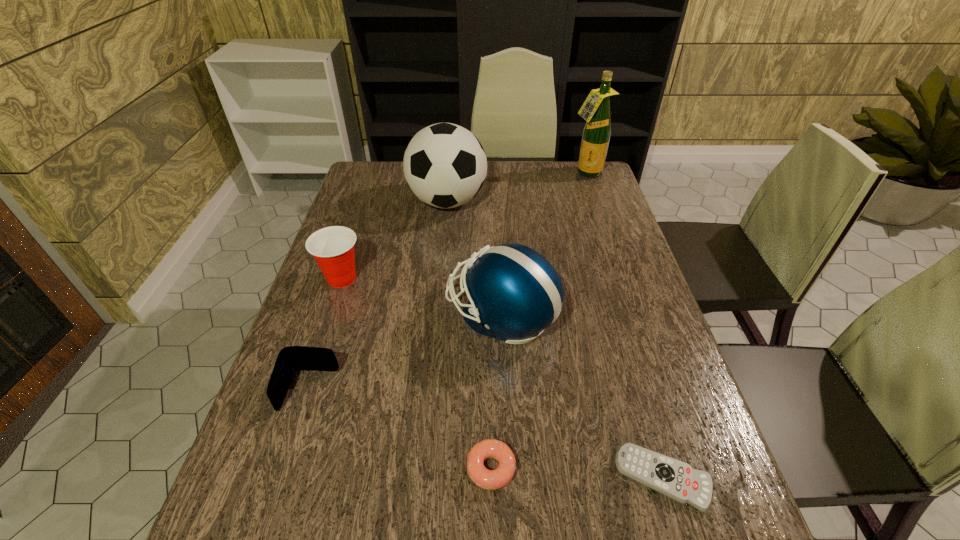
Where is `free point located 0.140m on the front-facing side of the liquor`? free point located 0.140m on the front-facing side of the liquor is located at coordinates (596, 202).

Locate an element on the screen. vacant space situated 0.110m on the left of the sixth nearest object is located at coordinates (374, 201).

Image resolution: width=960 pixels, height=540 pixels. What are the coordinates of `free space located at the front of the third tallest object with the faceguard` in the screenshot? It's located at (336, 315).

This screenshot has height=540, width=960. Identify the location of free space located at the front of the third tallest object with the faceguard. (x=348, y=315).

This screenshot has height=540, width=960. I want to click on free space located at the front of the third tallest object with the faceguard, so click(x=396, y=315).

Where is `free location located on the front of the cup`? The image size is (960, 540). free location located on the front of the cup is located at coordinates (317, 354).

Where is `vacant region located 0.080m on the outer surface of the wallet`? vacant region located 0.080m on the outer surface of the wallet is located at coordinates (289, 453).

I want to click on vacant area situated on the left of the doughnut, so click(391, 468).

Locate an element on the screen. vacant point located on the left of the shortest object is located at coordinates (419, 478).

Find the location of a particular element. This screenshot has width=960, height=540. liquor at the far edge is located at coordinates click(x=596, y=109).